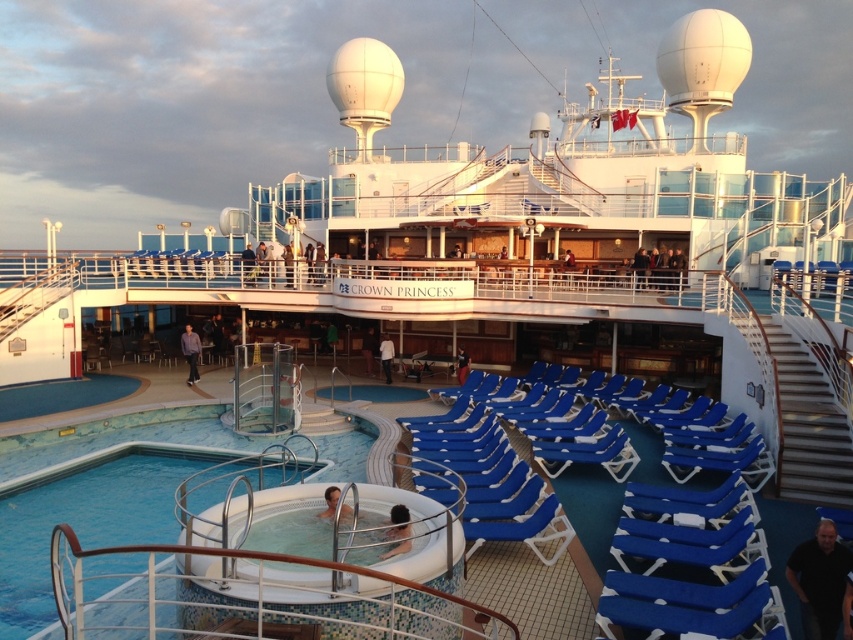
You are a passenger on the cruise ship and you see both the blue fabric jacket at center and the dark brown leather jacket at center. Which jacket takes up more space in the area?

The blue fabric jacket at center is larger in size than the dark brown leather jacket at center, so it takes up more space in the area.

You are a deck attendant on the Crown Princess cruise ship. You need to arrange additional lounge chairs between the black matte shirt at lower right and the purple cotton shirt at lower left. Which area has more space available for placing chairs?

The purple cotton shirt at lower left has more space available because the black matte shirt at lower right occupies less space than the purple cotton shirt at lower left.